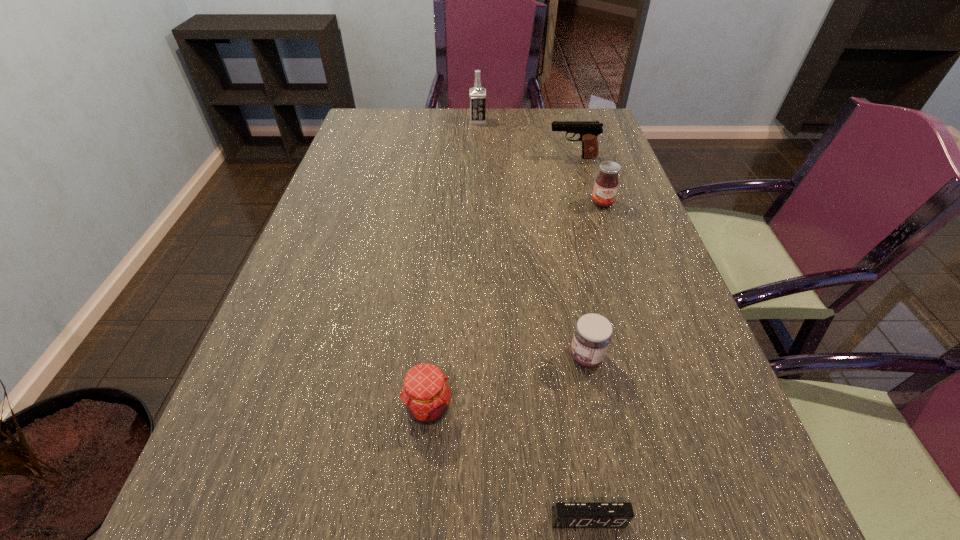
Where is `object that is positioned at the far edge`? object that is positioned at the far edge is located at coordinates (477, 94).

Where is `pistol that is at the right edge`? pistol that is at the right edge is located at coordinates (589, 130).

Identify the location of jam situated at the right edge. The image size is (960, 540). (606, 184).

The width and height of the screenshot is (960, 540). Identify the location of vacant space at the far edge of the desktop. (398, 137).

This screenshot has width=960, height=540. In the image, there is a desktop. Identify the location of free space at the left edge. click(x=351, y=238).

Where is `free space at the right edge of the desktop`? The width and height of the screenshot is (960, 540). free space at the right edge of the desktop is located at coordinates (592, 186).

I want to click on vacant space at the far right corner, so click(598, 111).

At what (x,y) coordinates should I click in order to perform the action: click on vacant region between the second nearest jam and the vodka. Please return your answer as a coordinate pair (x, y). Looking at the image, I should click on (532, 239).

At what (x,y) coordinates should I click in order to perform the action: click on unoccupied position between the fourth farthest object and the farthest jam. Please return your answer as a coordinate pair (x, y). The image size is (960, 540). Looking at the image, I should click on (594, 280).

Find the location of a particular element. The image size is (960, 540). vacant space in between the second farthest jam and the nearest object is located at coordinates (587, 438).